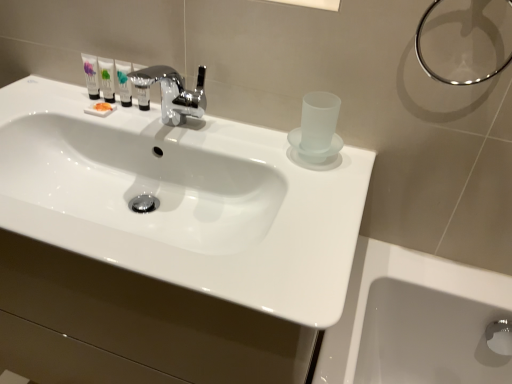
Question: Is white glossy sink at center at the back of matte white tube at upper left, the 1th mouthwash positioned from the left?

Choices:
 (A) no
 (B) yes

Answer: (A)

Question: Does matte white tube at upper left, the fourth mouthwash viewed from the right, lie in front of white glossy sink at center?

Choices:
 (A) no
 (B) yes

Answer: (A)

Question: Does matte white tube at upper left, the fourth mouthwash viewed from the right, come behind white glossy sink at center?

Choices:
 (A) no
 (B) yes

Answer: (B)

Question: Can you confirm if matte white tube at upper left, the 1th mouthwash positioned from the left, is taller than white glossy sink at center?

Choices:
 (A) yes
 (B) no

Answer: (B)

Question: From the image's perspective, is matte white tube at upper left, the fourth mouthwash viewed from the right, located beneath white glossy sink at center?

Choices:
 (A) no
 (B) yes

Answer: (A)

Question: Considering the positions of matte white tube at upper left, which ranks as the 3th mouthwash in right-to-left order, and matte white tube at upper left, the 1th mouthwash positioned from the left, in the image, is matte white tube at upper left, which ranks as the 3th mouthwash in right-to-left order, wider or thinner than matte white tube at upper left, the 1th mouthwash positioned from the left,?

Choices:
 (A) wide
 (B) thin

Answer: (B)

Question: Is matte white tube at upper left, which ranks as the 3th mouthwash in right-to-left order, in front of or behind matte white tube at upper left, the 1th mouthwash positioned from the left, in the image?

Choices:
 (A) front
 (B) behind

Answer: (A)

Question: Is matte white tube at upper left, the 2th mouthwash from the left, situated inside matte white tube at upper left, the 1th mouthwash positioned from the left, or outside?

Choices:
 (A) inside
 (B) outside

Answer: (B)

Question: From their relative heights in the image, would you say matte white tube at upper left, the 2th mouthwash from the left, is taller or shorter than matte white tube at upper left, the 1th mouthwash positioned from the left?

Choices:
 (A) tall
 (B) short

Answer: (B)

Question: Considering the positions of translucent plastic tube at upper center, the 3th mouthwash viewed from the left, and satin silver bottle at center, the first mouthwash when ordered from right to left, in the image, is translucent plastic tube at upper center, the 3th mouthwash viewed from the left, taller or shorter than satin silver bottle at center, the first mouthwash when ordered from right to left,?

Choices:
 (A) tall
 (B) short

Answer: (B)

Question: Is translucent plastic tube at upper center, which is the 2th mouthwash in right-to-left order, situated inside satin silver bottle at center, the first mouthwash when ordered from right to left, or outside?

Choices:
 (A) outside
 (B) inside

Answer: (A)

Question: Visually, is translucent plastic tube at upper center, the 3th mouthwash viewed from the left, positioned to the left or to the right of satin silver bottle at center, the first mouthwash when ordered from right to left?

Choices:
 (A) left
 (B) right

Answer: (A)

Question: From the image's perspective, is translucent plastic tube at upper center, the 3th mouthwash viewed from the left, above or below satin silver bottle at center, the first mouthwash when ordered from right to left?

Choices:
 (A) above
 (B) below

Answer: (A)

Question: Considering the positions of matte white tube at upper left, the 1th mouthwash positioned from the left, and metallic ring at upper right in the image, is matte white tube at upper left, the 1th mouthwash positioned from the left, bigger or smaller than metallic ring at upper right?

Choices:
 (A) small
 (B) big

Answer: (A)

Question: Considering the positions of matte white tube at upper left, the fourth mouthwash viewed from the right, and metallic ring at upper right in the image, is matte white tube at upper left, the fourth mouthwash viewed from the right, taller or shorter than metallic ring at upper right?

Choices:
 (A) short
 (B) tall

Answer: (A)